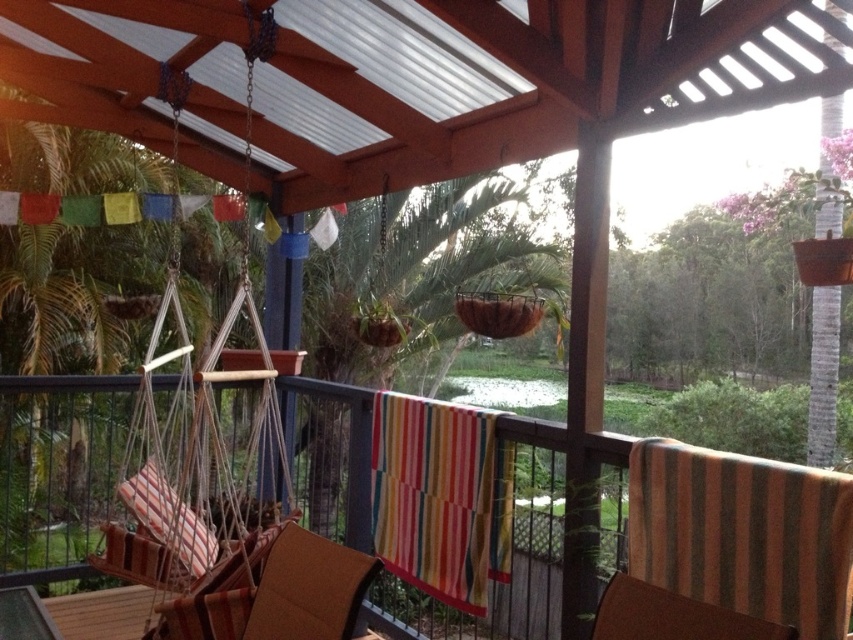
Question: Which point is farther to the camera?

Choices:
 (A) (639, 589)
 (B) (440, 461)
 (C) (245, 561)
 (D) (770, 552)

Answer: (B)

Question: Observing the image, what is the correct spatial positioning of brown striped fabric chair at center in reference to brown woven chair at center?

Choices:
 (A) below
 (B) above

Answer: (B)

Question: Is striped fabric swing at left to the right of brown striped fabric chair at center from the viewer's perspective?

Choices:
 (A) yes
 (B) no

Answer: (B)

Question: Among these objects, which one is nearest to the camera?

Choices:
 (A) striped fabric swing at left
 (B) striped fabric cushion at center
 (C) brown woven chair at center

Answer: (B)

Question: Can you confirm if brown striped fabric chair at center is positioned to the right of brown woven chair at center?

Choices:
 (A) no
 (B) yes

Answer: (B)

Question: Which of the following is the farthest from the observer?

Choices:
 (A) (141, 365)
 (B) (561, 561)
 (C) (705, 456)

Answer: (B)